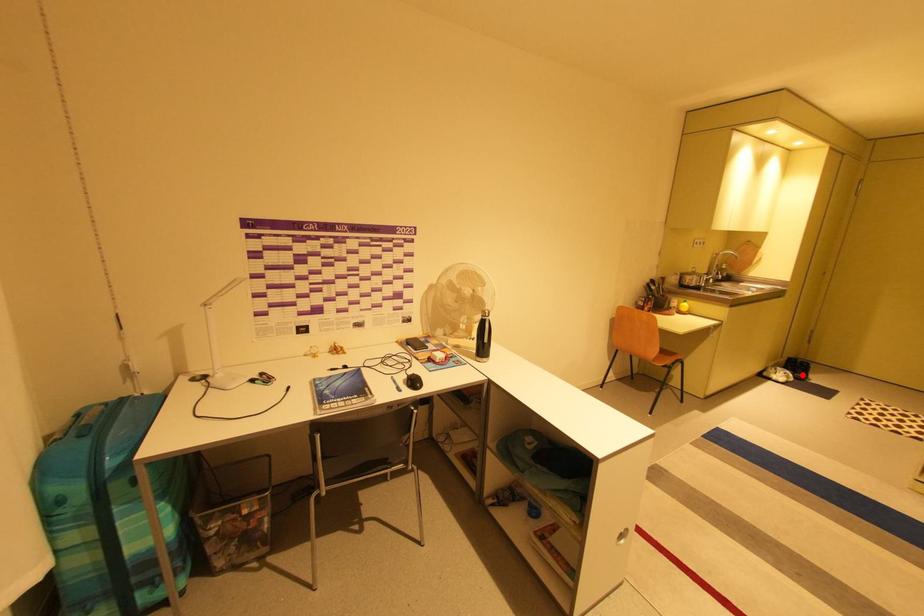
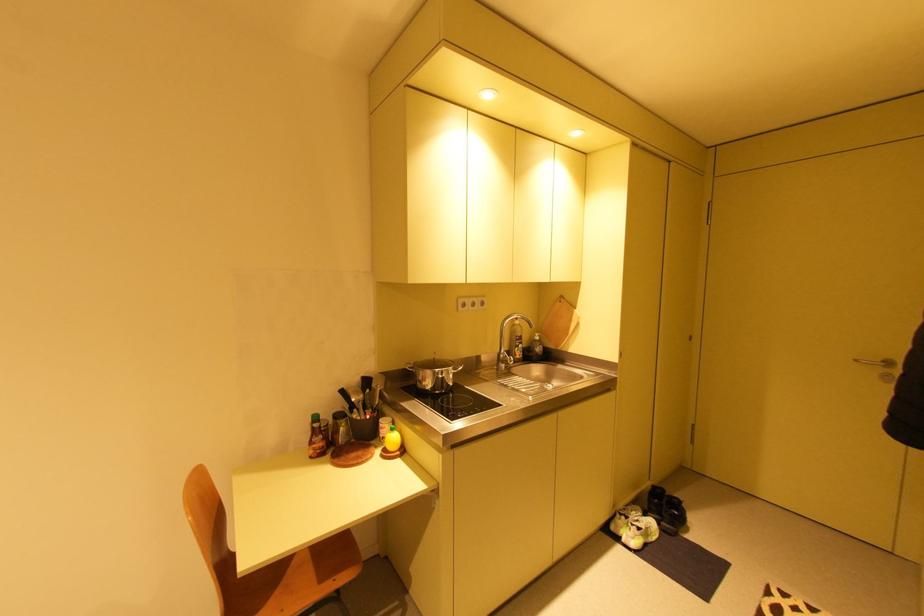
Find the pixel in the second image that matches the highlighted location in the first image.

(670, 524)